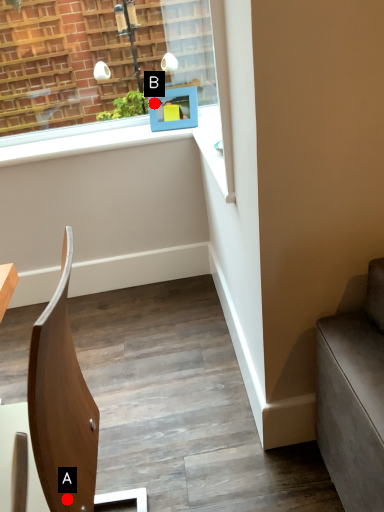
Question: Two points are circled on the image, labeled by A and B beside each circle. Among these points, which one is farthest from the camera?

Choices:
 (A) A is further
 (B) B is further

Answer: (B)